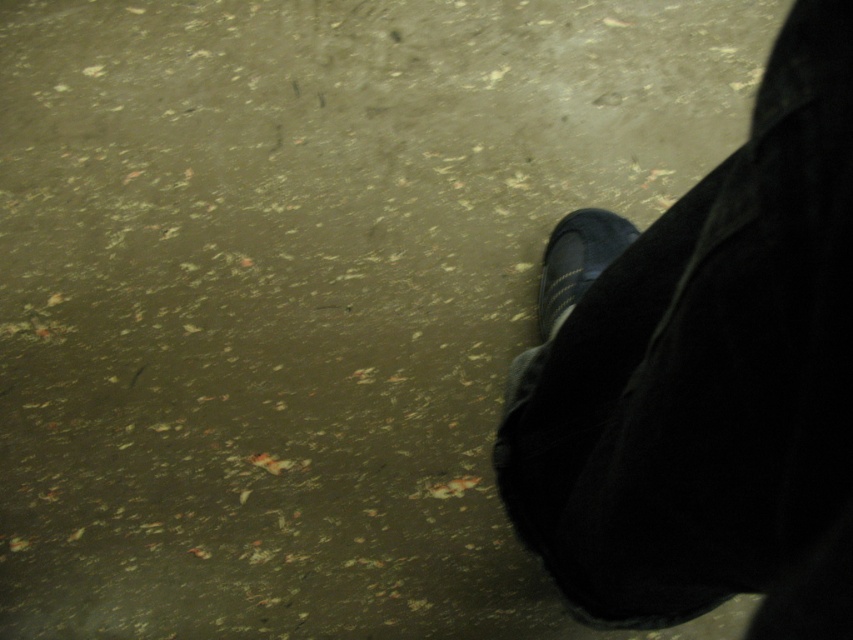
You are a designer trying to create a 3D model of the scene. You need to place the black fabric shoe at lower right accurately. What are the coordinates of its position?

The coordinates of the black fabric shoe at lower right are at point (704, 376).

You are trying to choose between two shoes in a store. You see the black fabric shoe at lower right and the matte black shoe at lower right. Which one has a bigger size?

The black fabric shoe at lower right is larger in size than the matte black shoe at lower right, so the black fabric shoe at lower right has a bigger size.

You are navigating a tight space and need to step carefully. You see two points on the ground labeled as point (572, 508) and point (548, 323). Which point should you step on first to move forward?

You should step on point (572, 508) first because it is in front of point (548, 323), allowing you to move forward more effectively.